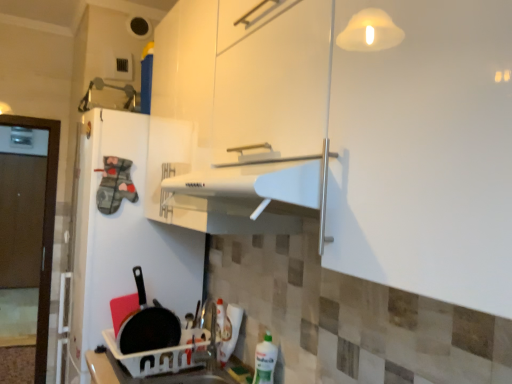
Question: Does point (265, 370) appear closer or farther from the camera than point (180, 372)?

Choices:
 (A) closer
 (B) farther

Answer: (A)

Question: In terms of size, does green plastic bottle at lower right appear bigger or smaller than white plastic sink at lower center?

Choices:
 (A) big
 (B) small

Answer: (B)

Question: Which object is positioned farthest from the black matte frying pan at lower left?

Choices:
 (A) green plastic bottle at lower right
 (B) white matte refrigerator at left
 (C) white plastic sink at lower center

Answer: (A)

Question: Considering the real-world distances, which object is farthest from the white matte refrigerator at left?

Choices:
 (A) black matte frying pan at lower left
 (B) white plastic sink at lower center
 (C) green plastic bottle at lower right

Answer: (C)